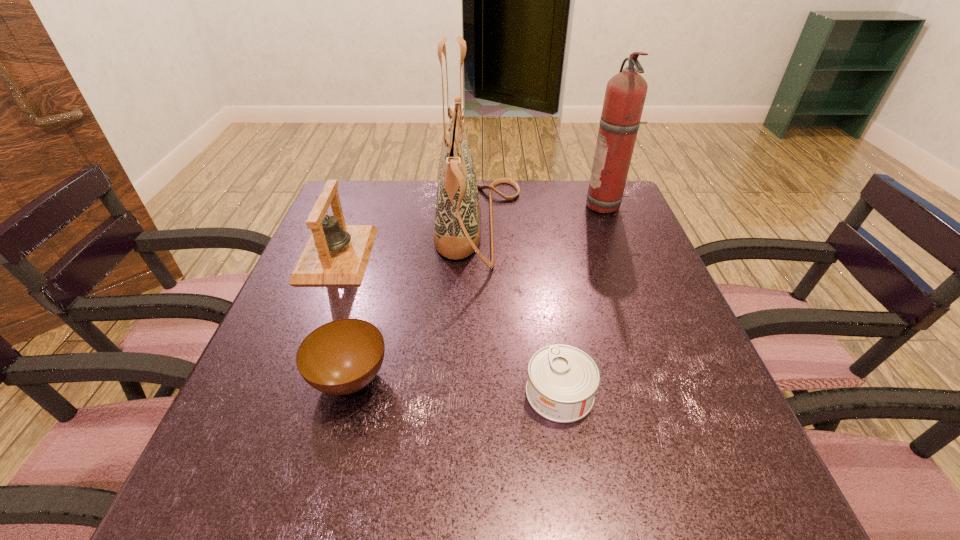
At what (x,y) coordinates should I click in order to perform the action: click on vacant region at the left edge of the desktop. Please return your answer as a coordinate pair (x, y). Looking at the image, I should click on (329, 395).

Find the location of a particular element. vacant region at the right edge is located at coordinates (636, 226).

This screenshot has width=960, height=540. In the image, there is a desktop. In order to click on free space at the far right corner in this screenshot , I will do `click(590, 219)`.

In the image, there is a desktop. At what (x,y) coordinates should I click in order to perform the action: click on vacant space at the near right corner. Please return your answer as a coordinate pair (x, y). The height and width of the screenshot is (540, 960). Looking at the image, I should click on (x=669, y=487).

At what (x,y) coordinates should I click in order to perform the action: click on empty location between the handbag and the can. Please return your answer as a coordinate pair (x, y). Looking at the image, I should click on (519, 309).

Identify the location of free space between the shortest object and the fire extinguisher. (583, 300).

You are a GUI agent. You are given a task and a screenshot of the screen. Output one action in this format:
    pyautogui.click(x=<x>, y=<y>)
    Task: Click on the free space between the bowl and the handbag
    The image size is (960, 540).
    Given the screenshot: What is the action you would take?
    pyautogui.click(x=415, y=302)

Image resolution: width=960 pixels, height=540 pixels. In order to click on vacant region between the can and the fire extinguisher in this screenshot , I will do `click(583, 300)`.

Locate an element on the screen. The image size is (960, 540). free area in between the can and the second shortest object is located at coordinates (455, 386).

Find the location of a particular element. This screenshot has width=960, height=540. vacant space in between the rightmost object and the fourth tallest object is located at coordinates (478, 293).